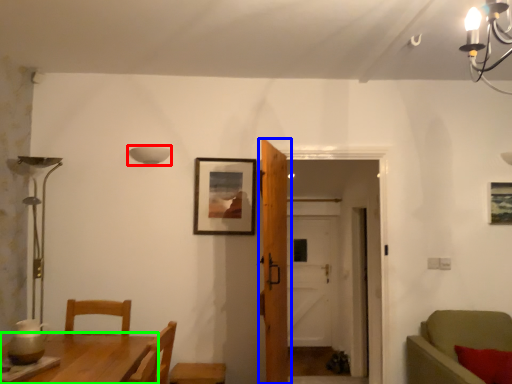
Question: Considering the real-world distances, which object is closest to lamp (highlighted by a red box)? door (highlighted by a blue box) or table (highlighted by a green box).

Choices:
 (A) door
 (B) table

Answer: (A)